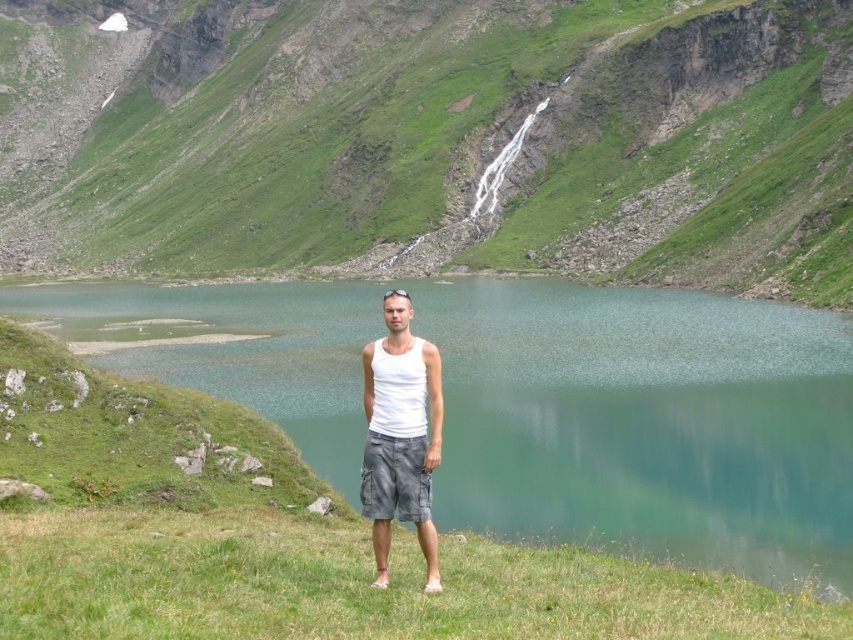
Question: Where is green grassy hillside at center located in relation to gray cotton shorts at center in the image?

Choices:
 (A) above
 (B) below

Answer: (A)

Question: Among these points, which one is farthest from the camera?

Choices:
 (A) (97, 515)
 (B) (668, 330)
 (C) (418, 339)
 (D) (373, 480)

Answer: (B)

Question: Does green smooth water at center appear over gray cotton shorts at center?

Choices:
 (A) yes
 (B) no

Answer: (A)

Question: Among these points, which one is farthest from the camera?

Choices:
 (A) (396, 508)
 (B) (569, 172)
 (C) (398, 440)

Answer: (B)

Question: Which is farther from the green grassy hillside at center?

Choices:
 (A) white cotton tank top at center
 (B) gray cotton shorts at center
 (C) green smooth water at center

Answer: (B)

Question: Does white cotton tank top at center appear under gray cotton shorts at center?

Choices:
 (A) no
 (B) yes

Answer: (A)